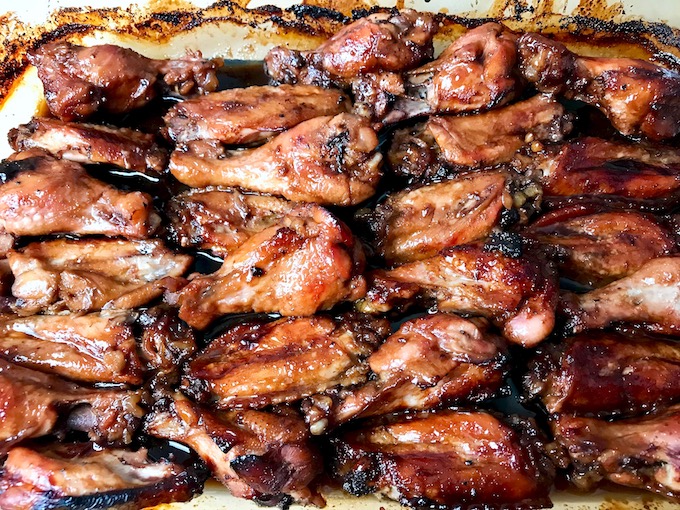
Locate an element on the screen. Image resolution: width=680 pixels, height=510 pixels. left side of dish is located at coordinates (15, 116).